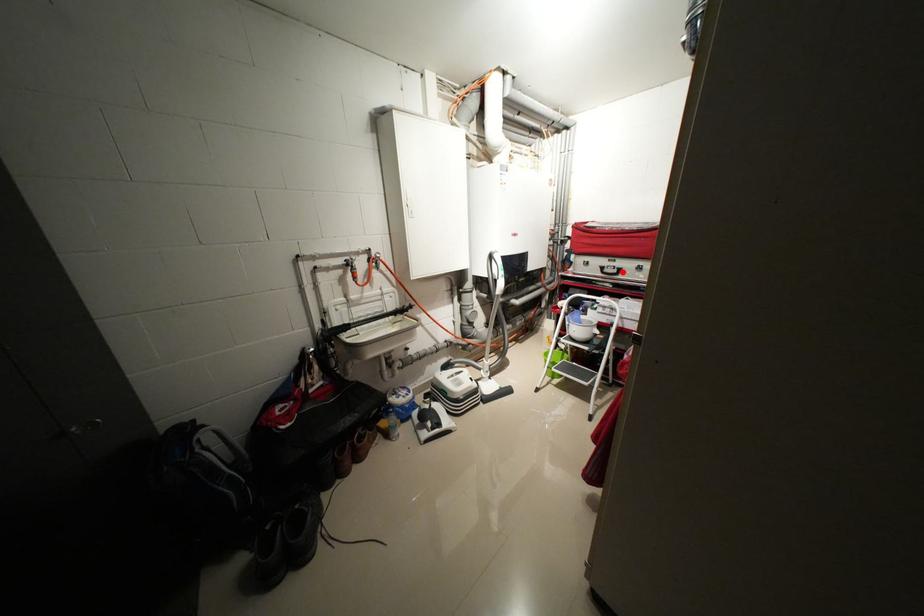
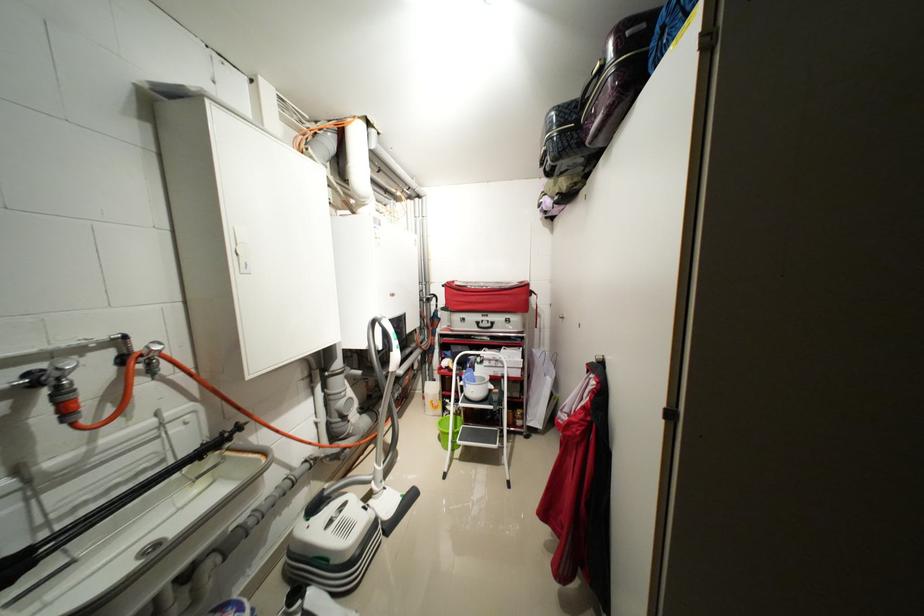
Question: I am providing you with two images of the same scene from different viewpoints. In image1, a red point is highlighted. Considering the same 3D point in image2, which of the following is correct?

Choices:
 (A) It is closer
 (B) It is farther

Answer: (B)